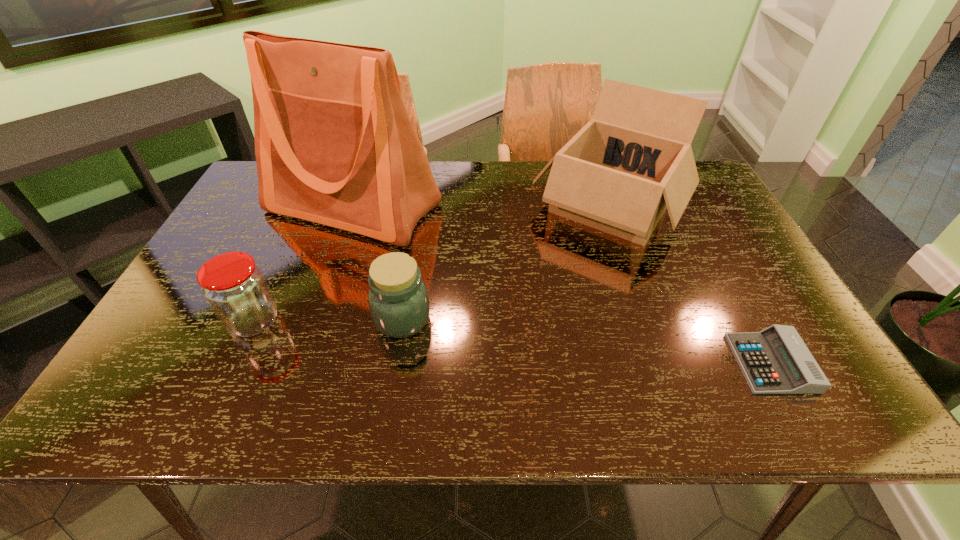
You are a GUI agent. You are given a task and a screenshot of the screen. Output one action in this format:
    pyautogui.click(x=<x>, y=<y>)
    Task: Click on the shopping bag that is at the far edge
    This screenshot has height=540, width=960.
    Given the screenshot: What is the action you would take?
    334,145

Locate an element on the screen. The image size is (960, 540). box at the far edge is located at coordinates [633, 159].

Find the location of `object present at the near edge`. object present at the near edge is located at coordinates (776, 360).

Locate an element on the screen. The image size is (960, 540). shopping bag at the left edge is located at coordinates (334, 145).

You are a GUI agent. You are given a task and a screenshot of the screen. Output one action in this format:
    pyautogui.click(x=<x>, y=<y>)
    Task: Click on the jar that is at the left edge
    The height and width of the screenshot is (540, 960).
    Given the screenshot: What is the action you would take?
    pyautogui.click(x=235, y=288)

You are a GUI agent. You are given a task and a screenshot of the screen. Output one action in this format:
    pyautogui.click(x=<x>, y=<y>)
    Task: Click on the box present at the right edge
    
    Given the screenshot: What is the action you would take?
    pyautogui.click(x=633, y=159)

This screenshot has width=960, height=540. Find the location of `calculator that is at the right edge`. calculator that is at the right edge is located at coordinates (776, 360).

Identify the location of object at the far left corner. The image size is (960, 540). (334, 145).

Where is `object that is positioned at the far right corner`? The width and height of the screenshot is (960, 540). object that is positioned at the far right corner is located at coordinates (633, 159).

Find the location of `object that is at the near right corner`. object that is at the near right corner is located at coordinates (776, 360).